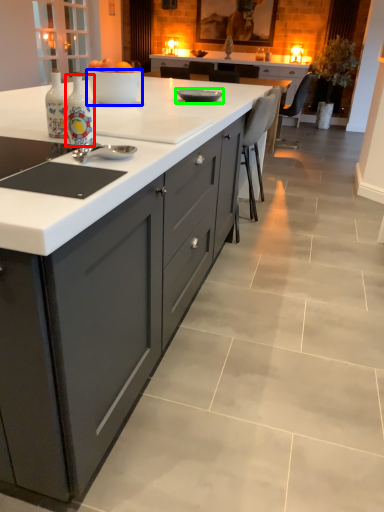
Question: Estimate the real-world distances between objects in this image. Which object is closer to bottle (highlighted by a red box), bowl (highlighted by a blue box) or kitchen appliance (highlighted by a green box)?

Choices:
 (A) bowl
 (B) kitchen appliance

Answer: (A)